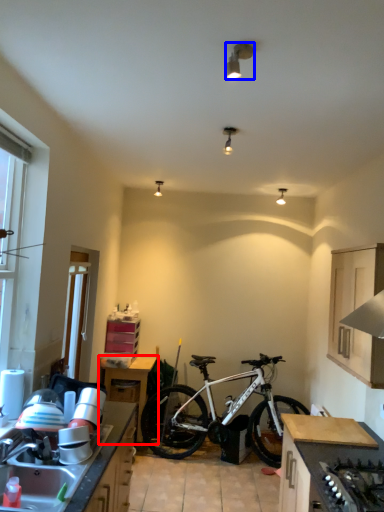
Question: Among these objects, which one is nearest to the camera, table (highlighted by a red box) or lamp (highlighted by a blue box)?

Choices:
 (A) table
 (B) lamp

Answer: (B)